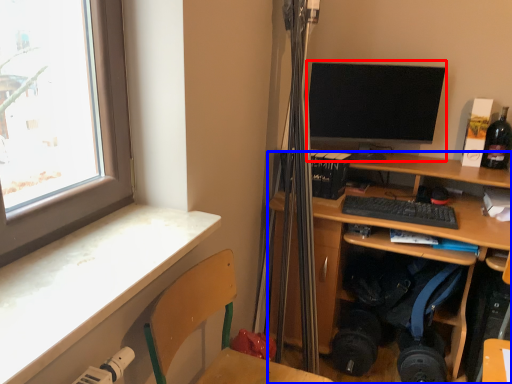
Question: Which object appears farthest to the camera in this image, computer monitor (highlighted by a red box) or desk (highlighted by a blue box)?

Choices:
 (A) computer monitor
 (B) desk

Answer: (A)